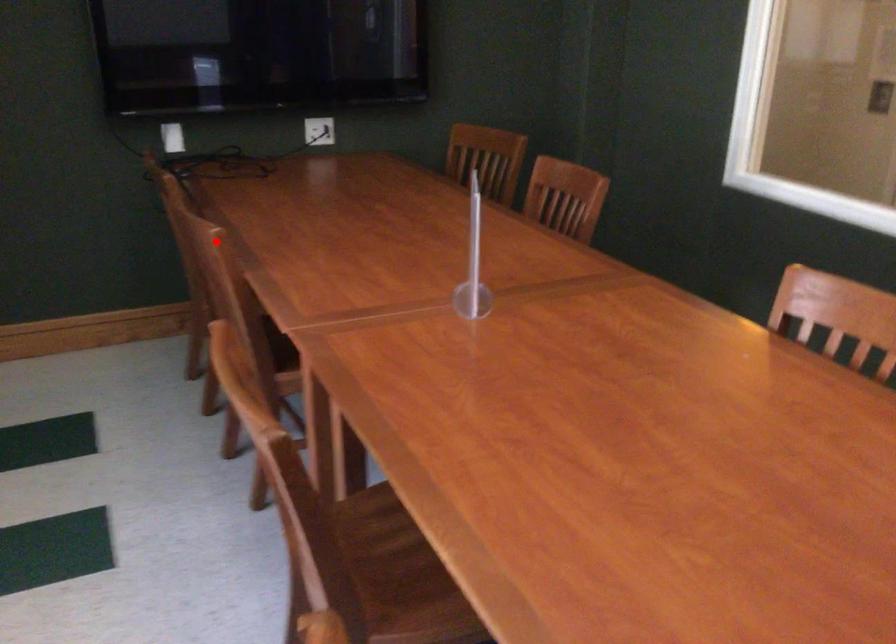
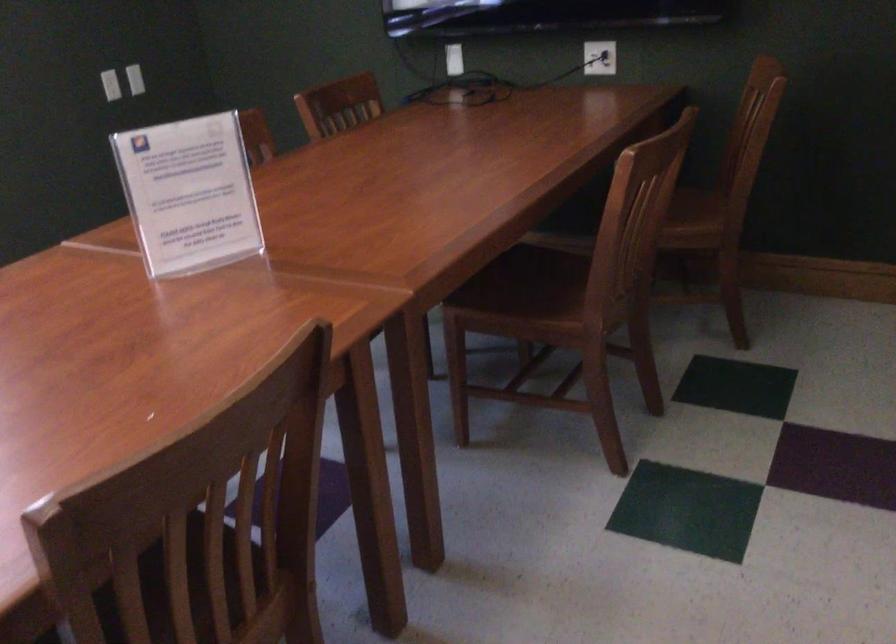
Question: I am providing you with two images of the same scene from different viewpoints. A red point is marked on the first image. At the location where the point appears in image 1, is it still visible in image 2?

Choices:
 (A) Yes
 (B) No

Answer: (B)